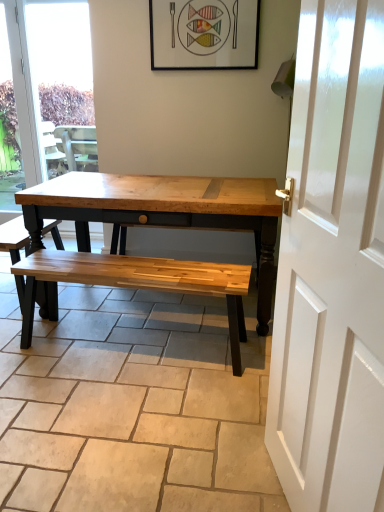
Where is `free space above natural wood bench at center (from a real-world perspective)`? free space above natural wood bench at center (from a real-world perspective) is located at coordinates (114, 355).